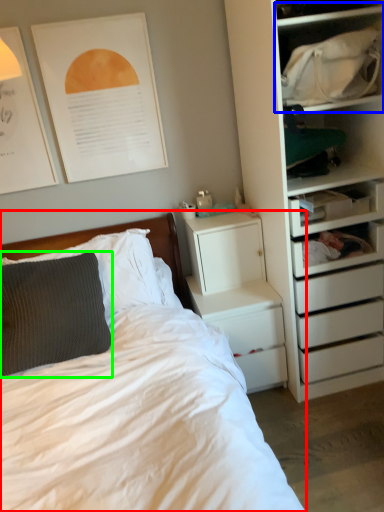
Question: Considering the real-world distances, which object is closest to bed (highlighted by a red box)? cabinet (highlighted by a blue box) or pillow (highlighted by a green box).

Choices:
 (A) cabinet
 (B) pillow

Answer: (B)